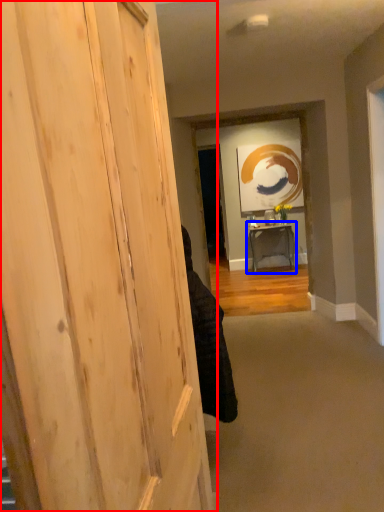
Question: Which point is further to the camera, door (highlighted by a red box) or table (highlighted by a blue box)?

Choices:
 (A) door
 (B) table

Answer: (B)